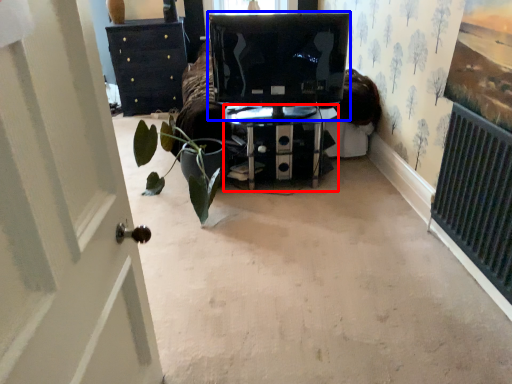
Question: Which point is further to the camera, furniture (highlighted by a red box) or computer monitor (highlighted by a blue box)?

Choices:
 (A) furniture
 (B) computer monitor

Answer: (A)